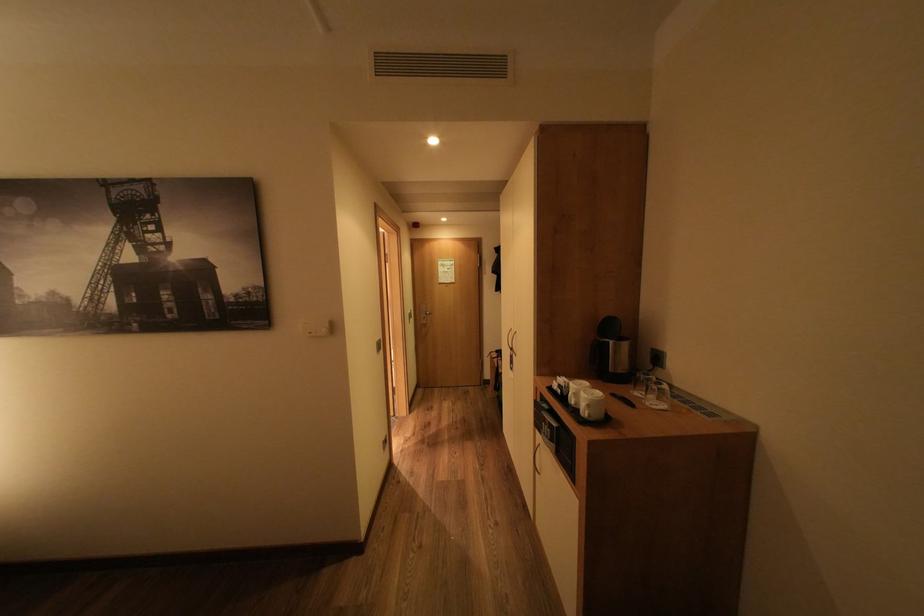
You are a GUI agent. You are given a task and a screenshot of the screen. Output one action in this format:
    pyautogui.click(x=<x>, y=<y>)
    Task: Click on the black kettle handle
    
    Given the screenshot: What is the action you would take?
    pyautogui.click(x=623, y=399)